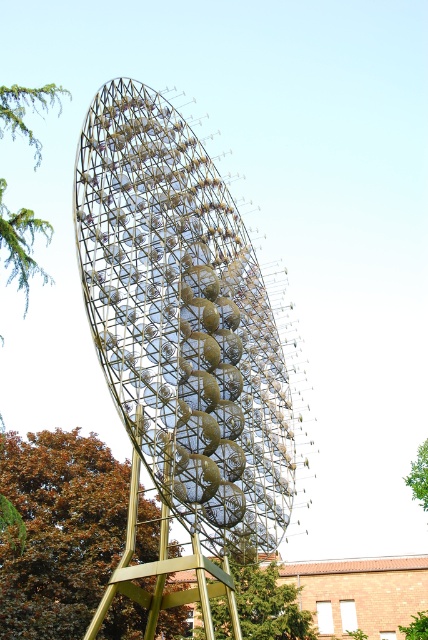
Question: Which of the following is the closest to the observer?

Choices:
 (A) green leafy tree at lower center
 (B) green leafy tree at upper left

Answer: (A)

Question: Is green leafy tree at lower center below green leafy tree at upper left?

Choices:
 (A) no
 (B) yes

Answer: (B)

Question: Does green leafy tree at lower left have a smaller size compared to green leafy tree at upper right?

Choices:
 (A) no
 (B) yes

Answer: (A)

Question: Which point appears farthest from the camera in this image?

Choices:
 (A) (80, 508)
 (B) (296, 625)
 (C) (29, 224)
 (D) (409, 472)

Answer: (D)

Question: Is green leafy tree at lower center to the left of green leafy tree at upper right from the viewer's perspective?

Choices:
 (A) yes
 (B) no

Answer: (A)

Question: Which of the following is the closest to the observer?

Choices:
 (A) (17, 90)
 (B) (178, 124)
 (C) (273, 586)
 (D) (406, 477)

Answer: (B)